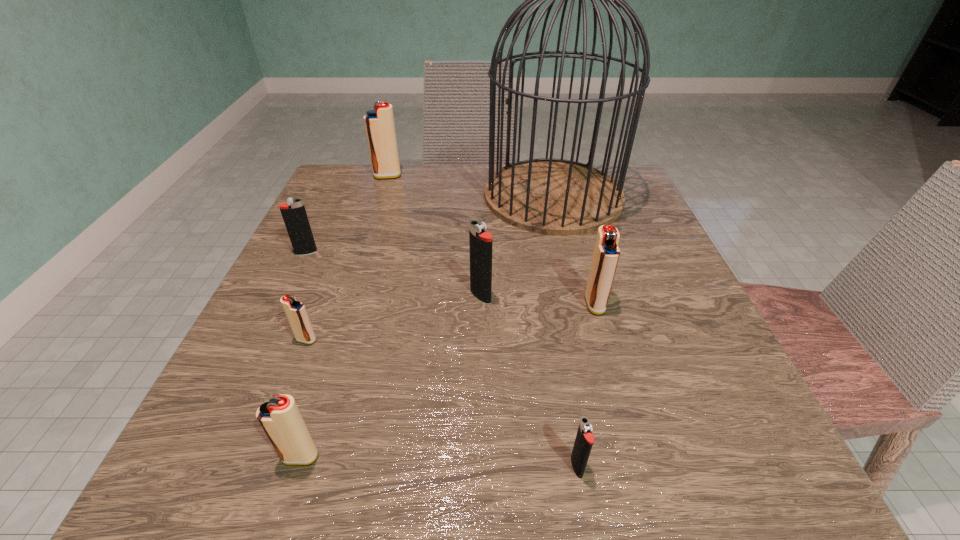
Where is `free space located 0.100m on the right of the third igniter from right to left`? This screenshot has height=540, width=960. free space located 0.100m on the right of the third igniter from right to left is located at coordinates (549, 296).

The height and width of the screenshot is (540, 960). Find the location of `vacant space located 0.110m on the front of the farthest black igniter`. vacant space located 0.110m on the front of the farthest black igniter is located at coordinates (286, 295).

Image resolution: width=960 pixels, height=540 pixels. I want to click on vacant space located 0.080m on the back of the second smallest red igniter, so click(x=321, y=393).

The image size is (960, 540). Find the location of `free point located on the right of the sixth farthest object`. free point located on the right of the sixth farthest object is located at coordinates (502, 340).

The width and height of the screenshot is (960, 540). Find the location of `free space located 0.380m on the left of the sixth igniter from left to right`. free space located 0.380m on the left of the sixth igniter from left to right is located at coordinates (259, 467).

I want to click on birdcage located in the far edge section of the desktop, so click(x=547, y=196).

Locate an element on the screen. The image size is (960, 540). igniter that is at the far edge is located at coordinates (379, 123).

The width and height of the screenshot is (960, 540). Find the location of `birdcage that is positioned at the right edge`. birdcage that is positioned at the right edge is located at coordinates (547, 196).

Locate an element on the screen. The image size is (960, 540). igniter that is at the right edge is located at coordinates (606, 254).

I want to click on object at the far left corner, so click(x=379, y=123).